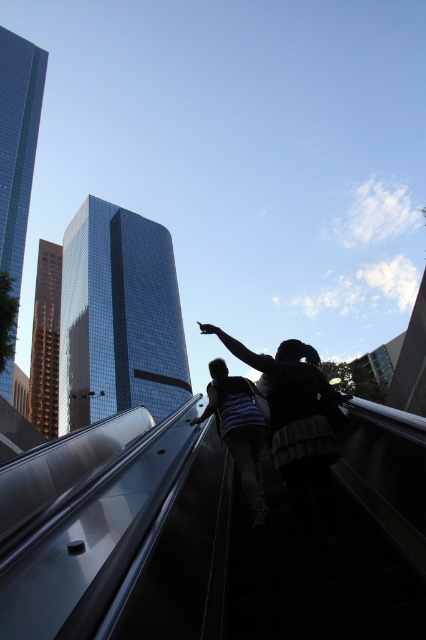
Can you confirm if silhouette casual clothing at center is shorter than dark blue jeans at center?

Incorrect, silhouette casual clothing at center's height does not fall short of dark blue jeans at center's.

Which is behind, point (325, 433) or point (244, 468)?

The point (244, 468) is more distant.

Find the location of `silhouette casual clothing at center`. silhouette casual clothing at center is located at coordinates (296, 422).